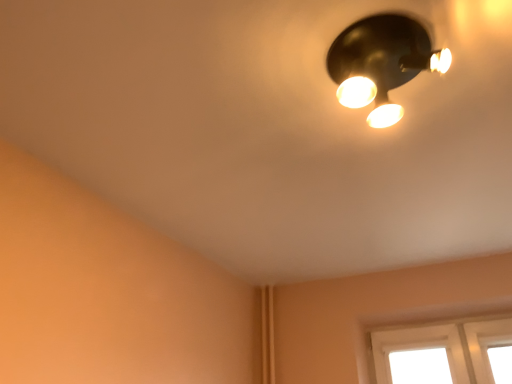
Locate an element on the screen. The height and width of the screenshot is (384, 512). matte black lamp at upper center is located at coordinates (381, 62).

What do you see at coordinates (381, 62) in the screenshot? Image resolution: width=512 pixels, height=384 pixels. I see `matte black lamp at upper center` at bounding box center [381, 62].

The height and width of the screenshot is (384, 512). Identify the location of matte black lamp at upper center. (381, 62).